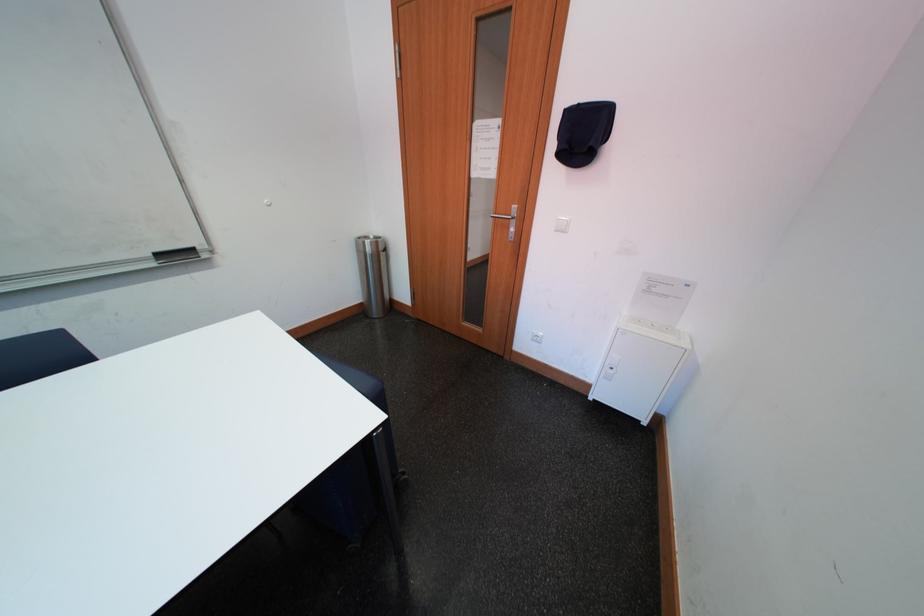
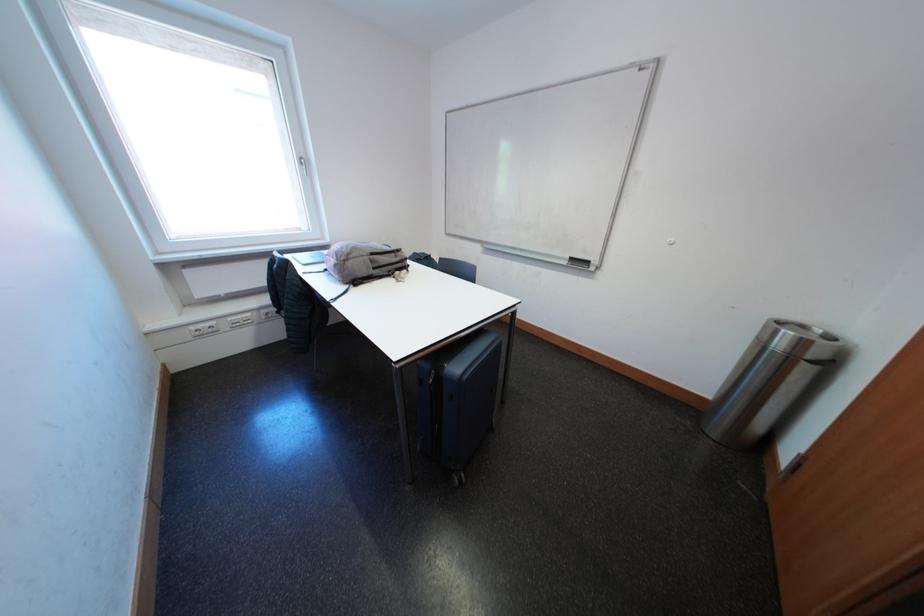
The first image is from the beginning of the video and the second image is from the end. How did the camera likely rotate when shooting the video?

The camera rotated toward left-down.